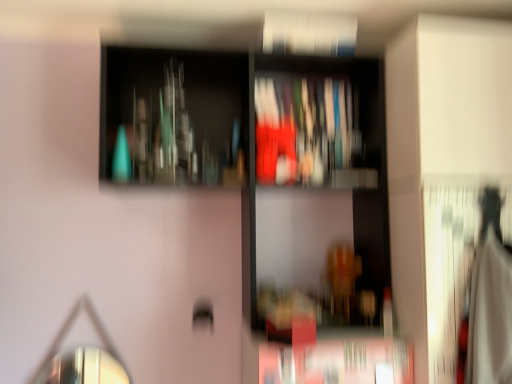
Find the location of `free location to the right of white paper book at upper center, acting as the first book starting from the front`. free location to the right of white paper book at upper center, acting as the first book starting from the front is located at coordinates (347, 55).